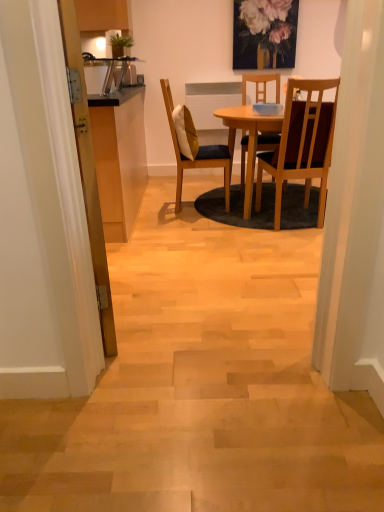
At what (x,y) coordinates should I click in order to perform the action: click on vacant space to the right of wooden door at left. Please return your answer as a coordinate pair (x, y). This screenshot has width=384, height=512. Looking at the image, I should click on (185, 301).